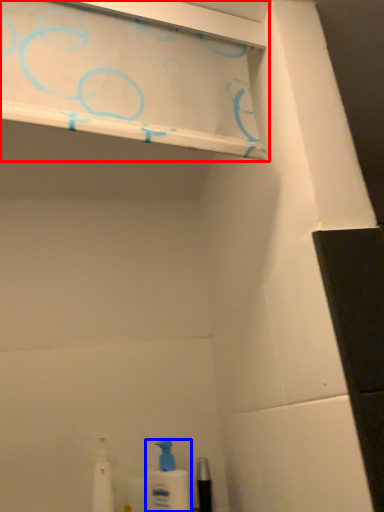
Question: Among these objects, which one is nearest to the camera, shelf (highlighted by a red box) or cleaning product (highlighted by a blue box)?

Choices:
 (A) shelf
 (B) cleaning product

Answer: (A)